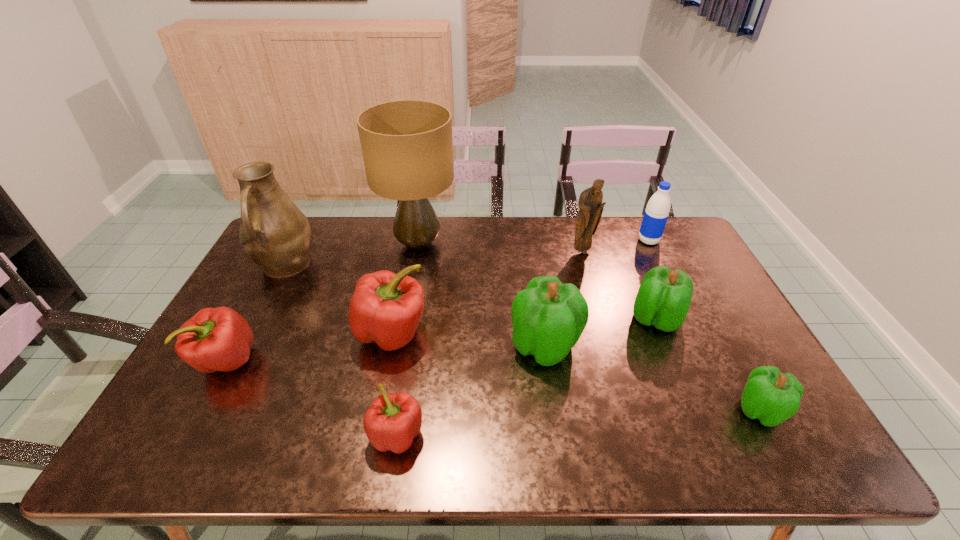
Where is `green bell pepper that is the second closest to the second bell pepper from right to left`? green bell pepper that is the second closest to the second bell pepper from right to left is located at coordinates (772, 397).

Where is `green bell pepper that is the nearest to the figurine`? Image resolution: width=960 pixels, height=540 pixels. green bell pepper that is the nearest to the figurine is located at coordinates (664, 296).

Locate an element on the screen. pink bell pepper that is the second closest one to the smallest pink bell pepper is located at coordinates (215, 339).

Locate which pink bell pepper ranks second in proximity to the pitcher. Please provide its 2D coordinates. Your answer should be formatted as a tuple, i.e. [(x, y)], where the tuple contains the x and y coordinates of a point satisfying the conditions above.

[(386, 308)]

This screenshot has height=540, width=960. Find the location of `free space that satisfies the following two spatial constraints: 1. on the back side of the blue water bottle; 2. on the right side of the beige lampshade`. free space that satisfies the following two spatial constraints: 1. on the back side of the blue water bottle; 2. on the right side of the beige lampshade is located at coordinates (419, 241).

This screenshot has width=960, height=540. What are the coordinates of `vacant space that satisfies the following two spatial constraints: 1. on the handle side of the second tallest object; 2. on the right side of the biggest pink bell pepper` in the screenshot? It's located at (251, 333).

This screenshot has height=540, width=960. I want to click on free location that satisfies the following two spatial constraints: 1. on the back side of the fourth bell pepper from left to right; 2. on the left side of the nearest pink bell pepper, so click(x=411, y=346).

The image size is (960, 540). What are the coordinates of `vacant space that satisfies the following two spatial constraints: 1. on the handle side of the biggest green bell pepper; 2. on the right side of the second tallest object` in the screenshot? It's located at (243, 346).